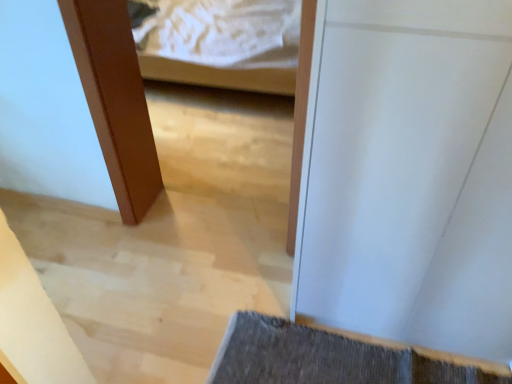
Question: Can you confirm if white glossy door at center is bigger than dark gray textured bath mat at lower right?

Choices:
 (A) yes
 (B) no

Answer: (A)

Question: Could you tell me if white glossy door at center is facing dark gray textured bath mat at lower right?

Choices:
 (A) no
 (B) yes

Answer: (B)

Question: Is white glossy door at center positioned before dark gray textured bath mat at lower right?

Choices:
 (A) yes
 (B) no

Answer: (A)

Question: Would you say white glossy door at center is a long distance from dark gray textured bath mat at lower right?

Choices:
 (A) yes
 (B) no

Answer: (B)

Question: Can you confirm if white glossy door at center is taller than dark gray textured bath mat at lower right?

Choices:
 (A) yes
 (B) no

Answer: (A)

Question: Is white glossy door at center looking in the opposite direction of dark gray textured bath mat at lower right?

Choices:
 (A) no
 (B) yes

Answer: (A)

Question: Could you tell me if dark gray textured bath mat at lower right is turned towards white glossy door at center?

Choices:
 (A) yes
 (B) no

Answer: (B)

Question: Is dark gray textured bath mat at lower right not near white glossy door at center?

Choices:
 (A) yes
 (B) no

Answer: (B)

Question: Considering the relative sizes of dark gray textured bath mat at lower right and white glossy door at center in the image provided, is dark gray textured bath mat at lower right taller than white glossy door at center?

Choices:
 (A) no
 (B) yes

Answer: (A)

Question: Does dark gray textured bath mat at lower right have a greater width compared to white glossy door at center?

Choices:
 (A) yes
 (B) no

Answer: (A)

Question: Considering the relative sizes of dark gray textured bath mat at lower right and white glossy door at center in the image provided, is dark gray textured bath mat at lower right thinner than white glossy door at center?

Choices:
 (A) no
 (B) yes

Answer: (A)

Question: From a real-world perspective, is dark gray textured bath mat at lower right positioned over white glossy door at center based on gravity?

Choices:
 (A) yes
 (B) no

Answer: (B)

Question: Considering the relative positions of dark gray textured bath mat at lower right and white glossy door at center in the image provided, is dark gray textured bath mat at lower right to the left or to the right of white glossy door at center?

Choices:
 (A) right
 (B) left

Answer: (B)